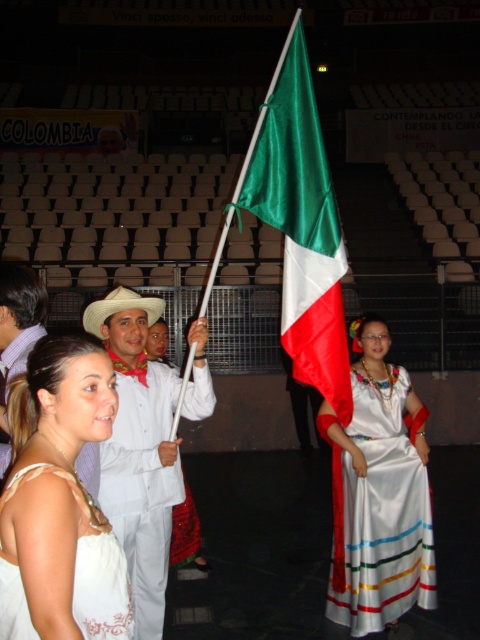
Question: Based on their relative distances, which object is farther from the white satin shirt at center?

Choices:
 (A) white felt cowboy hat at center
 (B) white satin dress at lower left

Answer: (B)

Question: Is white satin dress at lower left further to camera compared to white satin shirt at center?

Choices:
 (A) yes
 (B) no

Answer: (B)

Question: Among these objects, which one is nearest to the camera?

Choices:
 (A) matte white suit at center
 (B) white felt cowboy hat at center

Answer: (B)

Question: Can you confirm if white satin dress at center is smaller than matte white suit at center?

Choices:
 (A) yes
 (B) no

Answer: (B)

Question: Does shiny satin flag at center have a smaller size compared to white satin shirt at center?

Choices:
 (A) yes
 (B) no

Answer: (A)

Question: Among these points, which one is nearest to the camera?

Choices:
 (A) (300, 392)
 (B) (103, 304)
 (C) (313, 339)

Answer: (B)